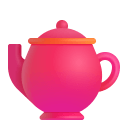
At what (x,y) coordinates should I click in order to perform the action: click on teapot top. Please return your answer as a coordinate pair (x, y). This screenshot has width=128, height=128. Looking at the image, I should click on (61, 24).